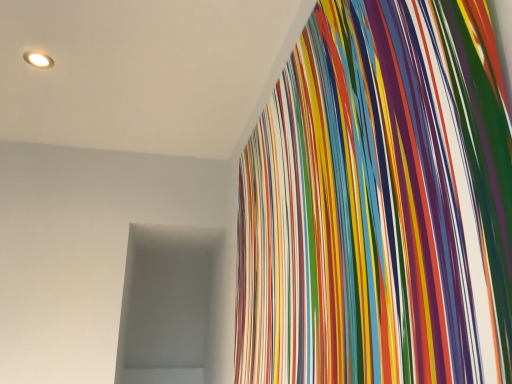
Locate an element on the screen. multicolored glossy stripes at upper right is located at coordinates click(x=379, y=204).

The width and height of the screenshot is (512, 384). What do you see at coordinates (379, 204) in the screenshot? I see `multicolored glossy stripes at upper right` at bounding box center [379, 204].

Where is `multicolored glossy stripes at upper right`? The height and width of the screenshot is (384, 512). multicolored glossy stripes at upper right is located at coordinates (379, 204).